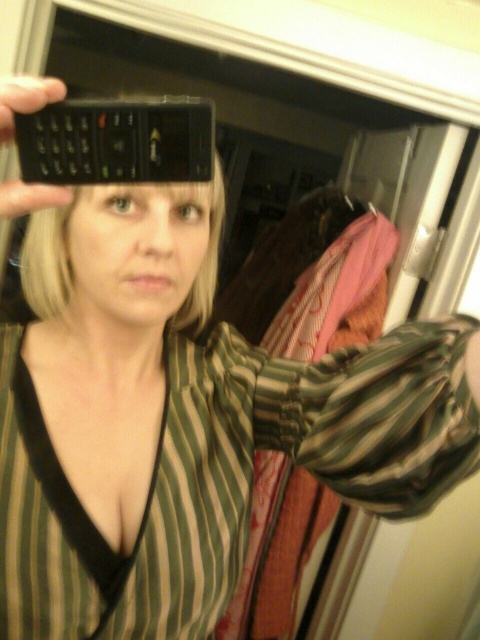
Does black matte phone at upper center have a lesser width compared to black matte phone at upper left?

No.

Is point (133, 100) positioned before point (38, 100)?

No, it is not.

Who is more distant from viewer, (193, 170) or (10, 184)?

The point (193, 170) is more distant.

This screenshot has width=480, height=640. What are the coordinates of `black matte phone at upper center` in the screenshot? It's located at (117, 141).